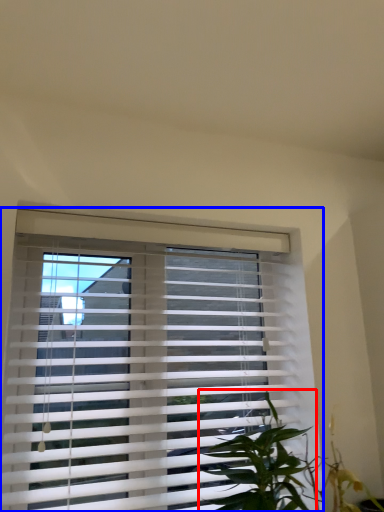
Question: Which point is closer to the camera, vegetation (highlighted by a red box) or window blind (highlighted by a blue box)?

Choices:
 (A) vegetation
 (B) window blind

Answer: (A)